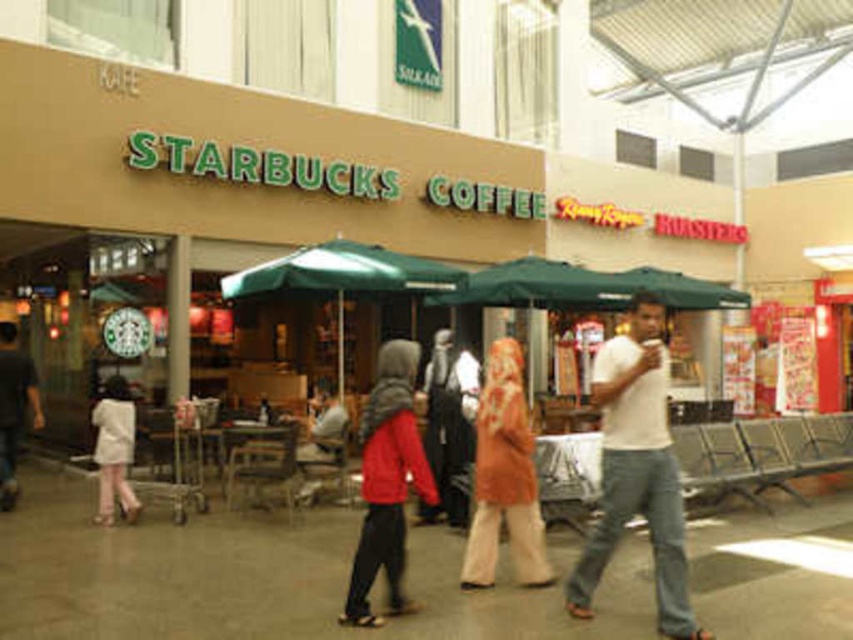
Describe the element at coordinates (343, 273) in the screenshot. I see `green fabric canopy at center` at that location.

Which is in front, point (328, 260) or point (96, 424)?

Point (328, 260) is in front.

Locate an element on the screen. The image size is (853, 640). green fabric canopy at center is located at coordinates pos(343,273).

You are a GUI agent. You are given a task and a screenshot of the screen. Output one action in this format:
    pyautogui.click(x=<x>, y=<y>)
    Task: Click on the green fabric canopy at center
    This screenshot has width=853, height=640.
    Given the screenshot: What is the action you would take?
    pyautogui.click(x=343, y=273)

Does white cotton t-shirt at center appear on the right side of orange fabric hijab at center?

Yes, white cotton t-shirt at center is to the right of orange fabric hijab at center.

How much distance is there between white cotton t-shirt at center and orange fabric hijab at center?

1.01 meters

Is point (659, 442) positioned behind point (509, 440)?

That is False.

What are the coordinates of `white cotton t-shirt at center` in the screenshot? It's located at (637, 468).

Can you confirm if red matte jacket at center is positioned to the right of black fabric jacket at center?

In fact, red matte jacket at center is to the left of black fabric jacket at center.

Does red matte jacket at center have a lesser height compared to black fabric jacket at center?

Correct, red matte jacket at center is not as tall as black fabric jacket at center.

Locate an element on the screen. The width and height of the screenshot is (853, 640). red matte jacket at center is located at coordinates (387, 483).

Identify the location of red matte jacket at center. This screenshot has height=640, width=853. 387,483.